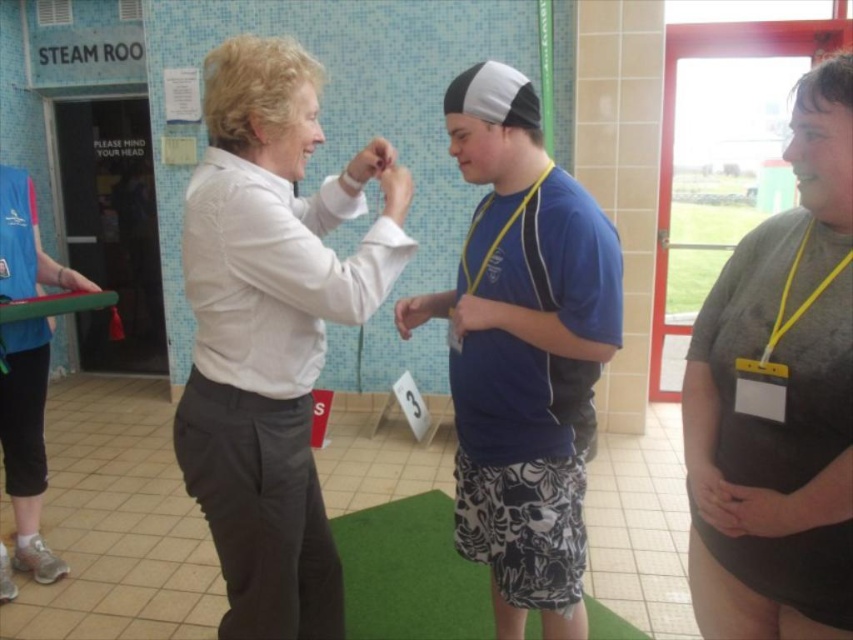
You are a lifeguard standing at the edge of the pool. You notice two shirts, a white smooth shirt at center and a blue fabric shirt at center, near the pool. If you need to grab both shirts quickly, can you reach them without moving from your spot?

The white smooth shirt at center and blue fabric shirt at center are 14.56 inches apart. Since the distance between them is less than the typical reach of a person, you can likely grab both shirts without moving from your spot.